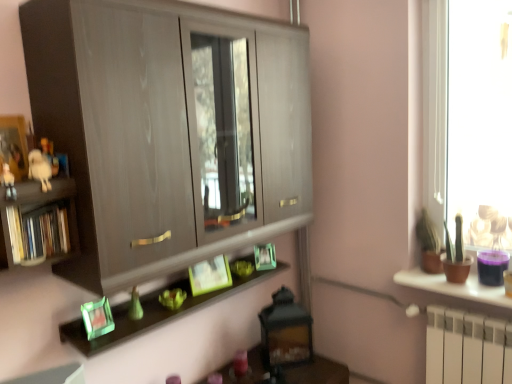
Question: Would you say green matte picture frame at center, the first picture frame viewed from the back, is a long distance from green matte cactus at right, which is counted as the second houseplant, starting from the back?

Choices:
 (A) no
 (B) yes

Answer: (A)

Question: Can you confirm if green matte picture frame at center, the first picture frame viewed from the back, is thinner than green matte cactus at right, which is counted as the second houseplant, starting from the back?

Choices:
 (A) no
 (B) yes

Answer: (B)

Question: Is green matte picture frame at center, which is the 3th picture frame from left to right, to the left of green matte cactus at right, which is counted as the second houseplant, starting from the back, from the viewer's perspective?

Choices:
 (A) yes
 (B) no

Answer: (A)

Question: From the image's perspective, does green matte picture frame at center, the first picture frame viewed from the back, appear lower than green matte cactus at right, which is counted as the second houseplant, starting from the back?

Choices:
 (A) yes
 (B) no

Answer: (A)

Question: From a real-world perspective, is green matte picture frame at center, the first picture frame from the right, on green matte cactus at right, the first houseplant viewed from the front?

Choices:
 (A) yes
 (B) no

Answer: (B)

Question: Is brown matte pot at right bigger or smaller than matte wood cabinet at center?

Choices:
 (A) small
 (B) big

Answer: (A)

Question: Do you think brown matte pot at right is within matte wood cabinet at center, or outside of it?

Choices:
 (A) inside
 (B) outside

Answer: (B)

Question: Considering the positions of point click(x=401, y=284) and point click(x=148, y=187), is point click(x=401, y=284) closer or farther from the camera than point click(x=148, y=187)?

Choices:
 (A) farther
 (B) closer

Answer: (A)

Question: Considering the relative positions of brown matte pot at right and matte wood cabinet at center in the image provided, is brown matte pot at right to the left or to the right of matte wood cabinet at center?

Choices:
 (A) left
 (B) right

Answer: (B)

Question: From a real-world perspective, is green matte picture frame at center, which appears as the 2th picture frame when viewed from the back, physically located above or below white matte figurine at left?

Choices:
 (A) below
 (B) above

Answer: (A)

Question: From the image's perspective, relative to white matte figurine at left, is green matte picture frame at center, which appears as the 2th picture frame when viewed from the back, above or below?

Choices:
 (A) below
 (B) above

Answer: (A)

Question: Visually, is green matte picture frame at center, which appears as the 2th picture frame when viewed from the back, positioned to the left or to the right of white matte figurine at left?

Choices:
 (A) left
 (B) right

Answer: (B)

Question: Relative to white matte figurine at left, is green matte picture frame at center, which appears as the 2th picture frame when viewed from the back, in front or behind?

Choices:
 (A) behind
 (B) front

Answer: (A)

Question: Considering the positions of green glass picture frame at lower left, the first picture frame when ordered from left to right, and green matte picture frame at center, the 3th picture frame positioned from the front, in the image, is green glass picture frame at lower left, the first picture frame when ordered from left to right, bigger or smaller than green matte picture frame at center, the 3th picture frame positioned from the front,?

Choices:
 (A) big
 (B) small

Answer: (A)

Question: Considering the positions of point (110, 327) and point (260, 251), is point (110, 327) closer or farther from the camera than point (260, 251)?

Choices:
 (A) closer
 (B) farther

Answer: (A)